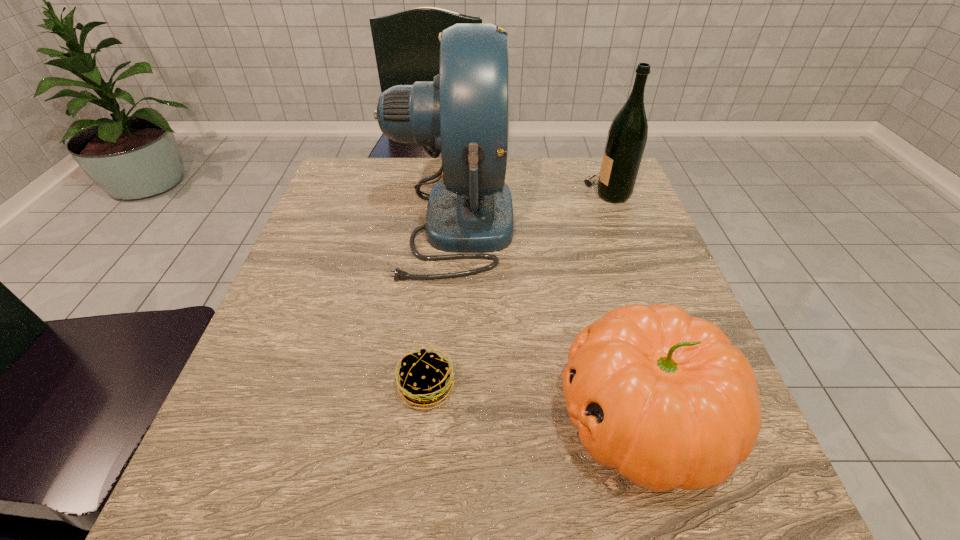
Find the location of a particular element. The height and width of the screenshot is (540, 960). fan that is at the far edge is located at coordinates (463, 114).

Image resolution: width=960 pixels, height=540 pixels. What are the coordinates of `wine bottle present at the far edge` in the screenshot? It's located at (627, 136).

The image size is (960, 540). I want to click on object located at the near edge, so click(x=665, y=398).

Image resolution: width=960 pixels, height=540 pixels. In order to click on wine bottle present at the right edge in this screenshot , I will do `click(627, 136)`.

This screenshot has height=540, width=960. Identify the location of pumpkin that is at the right edge. (665, 398).

Locate an element on the screen. The height and width of the screenshot is (540, 960). object situated at the far right corner is located at coordinates (627, 136).

Identify the location of object positioned at the near right corner. The image size is (960, 540). (665, 398).

At what (x,y) coordinates should I click in order to perform the action: click on vacant area at the far edge. Please return your answer as a coordinate pair (x, y). The width and height of the screenshot is (960, 540). Looking at the image, I should click on (528, 199).

Locate an element on the screen. The image size is (960, 540). vacant area at the left edge is located at coordinates (317, 289).

You are a GUI agent. You are given a task and a screenshot of the screen. Output one action in this format:
    pyautogui.click(x=<x>, y=<y>)
    Task: Click on the vacant space at the right edge of the desktop
    This screenshot has width=960, height=540.
    Given the screenshot: What is the action you would take?
    pyautogui.click(x=616, y=216)